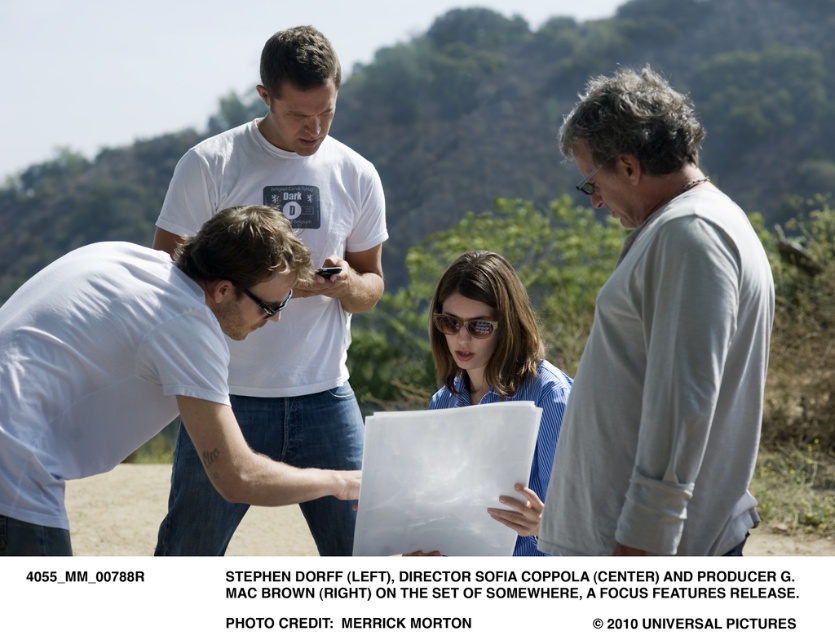
Is blue striped shirt at center further to the viewer compared to matte black goggles at center?

Yes.

Does blue striped shirt at center have a lesser height compared to matte black goggles at center?

In fact, blue striped shirt at center may be taller than matte black goggles at center.

At what (x,y) coordinates should I click in order to perform the action: click on blue striped shirt at center. Please return your answer as a coordinate pair (x, y). Looking at the image, I should click on (498, 369).

Is gray cotton shirt at center further to camera compared to brown reflective sunglasses at center?

No, it is not.

Between gray cotton shirt at center and brown reflective sunglasses at center, which one appears on the right side from the viewer's perspective?

gray cotton shirt at center is more to the right.

Between point (671, 262) and point (449, 332), which one is positioned behind?

Positioned behind is point (449, 332).

This screenshot has height=640, width=835. I want to click on gray cotton shirt at center, so click(660, 342).

Can you confirm if white t-shirt at upper center is positioned to the right of matte black goggles at center?

In fact, white t-shirt at upper center is to the left of matte black goggles at center.

How far apart are white t-shirt at upper center and matte black goggles at center?

They are 4.48 feet apart.

Between point (272, 56) and point (257, 296), which one is positioned behind?

Point (272, 56)

Locate an element on the screen. The width and height of the screenshot is (835, 640). white t-shirt at upper center is located at coordinates (304, 243).